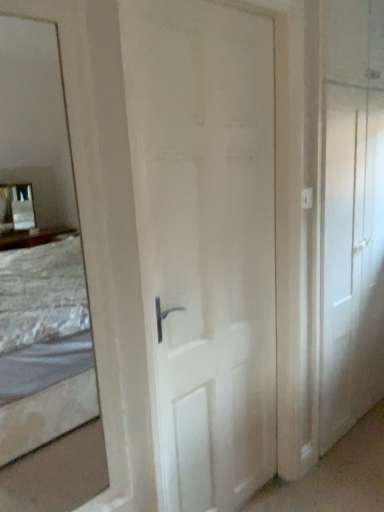
What are the coordinates of `white matte door at center, which appears as the second door when viewed from the right` in the screenshot? It's located at (205, 242).

This screenshot has width=384, height=512. What do you see at coordinates (205, 242) in the screenshot?
I see `white matte door at center, which is the 1th door in left-to-right order` at bounding box center [205, 242].

The width and height of the screenshot is (384, 512). Find the location of `white matte door at right, marked as the 1th door in a right-to-left arrangement`. white matte door at right, marked as the 1th door in a right-to-left arrangement is located at coordinates (351, 257).

This screenshot has height=512, width=384. What do you see at coordinates (351, 257) in the screenshot?
I see `white matte door at right, marked as the 1th door in a right-to-left arrangement` at bounding box center [351, 257].

Identify the location of white matte door at center, which is the 1th door in left-to-right order. (205, 242).

Based on their positions, is white matte door at center, which appears as the second door when viewed from the right, located to the left or right of white matte door at right, the second door viewed from the left?

white matte door at center, which appears as the second door when viewed from the right, is positioned on white matte door at right, the second door viewed from the left,'s left side.

Which is behind, white matte door at center, which appears as the second door when viewed from the right, or white matte door at right, the second door viewed from the left?

white matte door at right, the second door viewed from the left, is behind.

Which point is more distant from viewer, (170, 79) or (376, 356)?

The point (376, 356) is behind.

From the image's perspective, which is below, white matte door at center, which appears as the second door when viewed from the right, or white matte door at right, the second door viewed from the left?

white matte door at center, which appears as the second door when viewed from the right, appears lower in the image.

From a real-world perspective, relative to white matte door at right, marked as the 1th door in a right-to-left arrangement, is white matte door at center, which is the 1th door in left-to-right order, vertically above or below?

From a real-world perspective, white matte door at center, which is the 1th door in left-to-right order, is physically below white matte door at right, marked as the 1th door in a right-to-left arrangement.

From the picture: Is white matte door at center, which appears as the second door when viewed from the right, thinner than white matte door at right, the second door viewed from the left?

In fact, white matte door at center, which appears as the second door when viewed from the right, might be wider than white matte door at right, the second door viewed from the left.

Who is taller, white matte door at center, which is the 1th door in left-to-right order, or white matte door at right, the second door viewed from the left?

With more height is white matte door at right, the second door viewed from the left.

Considering the sizes of objects white matte door at center, which appears as the second door when viewed from the right, and white matte door at right, the second door viewed from the left, in the image provided, who is smaller, white matte door at center, which appears as the second door when viewed from the right, or white matte door at right, the second door viewed from the left,?

With smaller size is white matte door at center, which appears as the second door when viewed from the right.

Looking at this image, would you say white matte door at center, which appears as the second door when viewed from the right, is inside or outside white matte door at right, marked as the 1th door in a right-to-left arrangement?

white matte door at center, which appears as the second door when viewed from the right, is located beyond the bounds of white matte door at right, marked as the 1th door in a right-to-left arrangement.

Is white matte door at center, which is the 1th door in left-to-right order, next to white matte door at right, marked as the 1th door in a right-to-left arrangement, and touching it?

No, white matte door at center, which is the 1th door in left-to-right order, is not next to white matte door at right, marked as the 1th door in a right-to-left arrangement.

Is white matte door at center, which appears as the second door when viewed from the right, oriented towards white matte door at right, the second door viewed from the left?

No, white matte door at center, which appears as the second door when viewed from the right, is not aimed at white matte door at right, the second door viewed from the left.

How different are the orientations of white matte door at center, which is the 1th door in left-to-right order, and white matte door at right, marked as the 1th door in a right-to-left arrangement, in degrees?

There is a 0.349-degree angle between the facing directions of white matte door at center, which is the 1th door in left-to-right order, and white matte door at right, marked as the 1th door in a right-to-left arrangement.

Could you measure the distance between white matte door at center, which is the 1th door in left-to-right order, and white matte door at right, marked as the 1th door in a right-to-left arrangement?

The distance of white matte door at center, which is the 1th door in left-to-right order, from white matte door at right, marked as the 1th door in a right-to-left arrangement, is 22.65 inches.

Locate an element on the screen. The image size is (384, 512). door that appears below the white matte door at right, the second door viewed from the left (from a real-world perspective) is located at coordinates click(205, 242).

Between white matte door at right, the second door viewed from the left, and white matte door at center, which is the 1th door in left-to-right order, which one appears on the left side from the viewer's perspective?

From the viewer's perspective, white matte door at center, which is the 1th door in left-to-right order, appears more on the left side.

Considering the relative positions of white matte door at right, the second door viewed from the left, and white matte door at center, which is the 1th door in left-to-right order, in the image provided, is white matte door at right, the second door viewed from the left, behind white matte door at center, which is the 1th door in left-to-right order,?

Yes, white matte door at right, the second door viewed from the left, is behind white matte door at center, which is the 1th door in left-to-right order.

Is point (370, 378) closer or farther from the camera than point (226, 331)?

Point (370, 378) is positioned farther from the camera compared to point (226, 331).

From the image's perspective, is white matte door at right, marked as the 1th door in a right-to-left arrangement, beneath white matte door at center, which is the 1th door in left-to-right order?

No.

In the scene shown: From a real-world perspective, is white matte door at right, marked as the 1th door in a right-to-left arrangement, physically above white matte door at center, which is the 1th door in left-to-right order?

Yes, from a real-world perspective, white matte door at right, marked as the 1th door in a right-to-left arrangement, is above white matte door at center, which is the 1th door in left-to-right order.

Considering the sizes of objects white matte door at right, marked as the 1th door in a right-to-left arrangement, and white matte door at center, which appears as the second door when viewed from the right, in the image provided, who is thinner, white matte door at right, marked as the 1th door in a right-to-left arrangement, or white matte door at center, which appears as the second door when viewed from the right,?

white matte door at right, marked as the 1th door in a right-to-left arrangement.

Does white matte door at right, marked as the 1th door in a right-to-left arrangement, have a greater height compared to white matte door at center, which appears as the second door when viewed from the right?

Yes.

Which of these two, white matte door at right, marked as the 1th door in a right-to-left arrangement, or white matte door at center, which appears as the second door when viewed from the right, is bigger?

white matte door at right, marked as the 1th door in a right-to-left arrangement.

Can we say white matte door at right, marked as the 1th door in a right-to-left arrangement, lies outside white matte door at center, which is the 1th door in left-to-right order?

Absolutely, white matte door at right, marked as the 1th door in a right-to-left arrangement, is external to white matte door at center, which is the 1th door in left-to-right order.

Would you say white matte door at right, marked as the 1th door in a right-to-left arrangement, is a long distance from white matte door at center, which appears as the second door when viewed from the right?

They are positioned close to each other.

Is white matte door at right, the second door viewed from the left, facing away from white matte door at center, which is the 1th door in left-to-right order?

No, white matte door at right, the second door viewed from the left, is not facing the opposite direction of white matte door at center, which is the 1th door in left-to-right order.

What's the angular difference between white matte door at right, the second door viewed from the left, and white matte door at center, which is the 1th door in left-to-right order,'s facing directions?

0.349 degrees.

Measure the distance between white matte door at right, the second door viewed from the left, and white matte door at center, which appears as the second door when viewed from the right.

The distance of white matte door at right, the second door viewed from the left, from white matte door at center, which appears as the second door when viewed from the right, is 22.65 inches.

Where is `door above the white matte door at center, which is the 1th door in left-to-right order (from a real-world perspective)`? door above the white matte door at center, which is the 1th door in left-to-right order (from a real-world perspective) is located at coordinates (351, 257).

Where is `door positioned vertically above the white matte door at center, which appears as the second door when viewed from the right (from a real-world perspective)`? door positioned vertically above the white matte door at center, which appears as the second door when viewed from the right (from a real-world perspective) is located at coordinates (351, 257).

Locate an element on the screen. door on the left of white matte door at right, marked as the 1th door in a right-to-left arrangement is located at coordinates (205, 242).